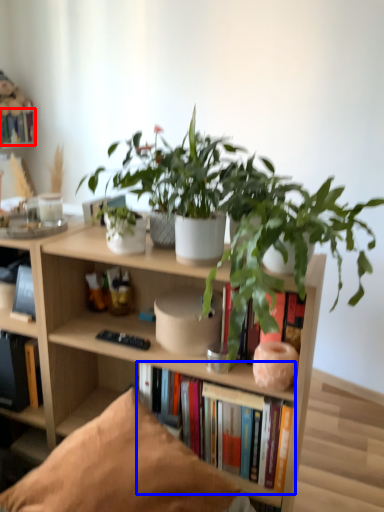
Question: Which object appears closest to the camera in this image, book (highlighted by a red box) or book (highlighted by a blue box)?

Choices:
 (A) book
 (B) book

Answer: (B)